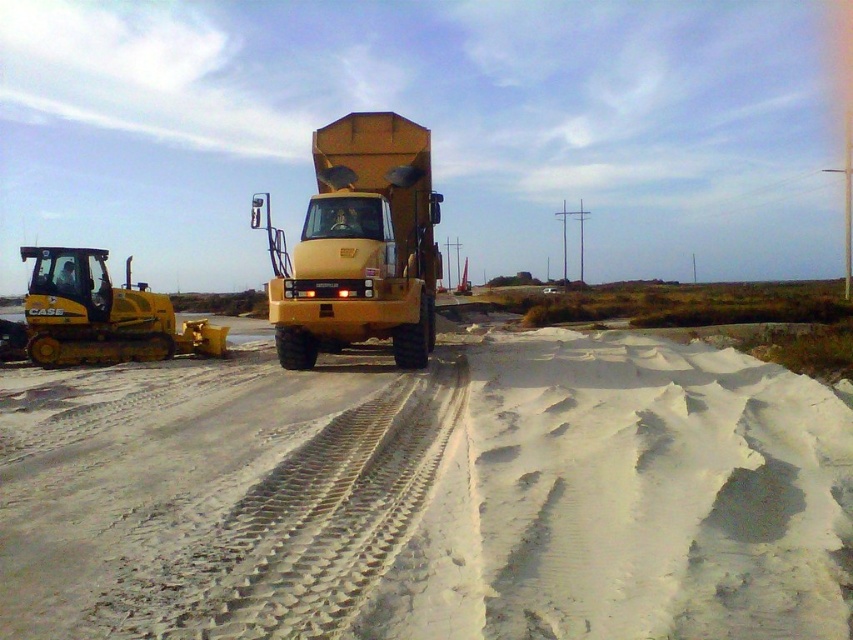
You are standing at the point marked by coordinates point (358, 244) in the construction scene. What object are you directly standing on?

The point (358, 244) marks the yellow matte dump truck at center, so you are directly standing on the yellow matte dump truck at center.

Looking at this image, you are a surveyor using a GPS device. You need to mark the location of the yellow matte dump truck at center. What are the coordinates of its position?

The coordinates of the yellow matte dump truck at center are at point (358, 244).

You are a construction worker standing at the edge of the sandy terrain. You need to move a heavy object from the yellow rubber plow at left to the yellow matte dump truck at center. Which direction should you move the object to ensure it is closer to the dump truck?

Since the yellow matte dump truck at center is closer to the viewer than the yellow rubber plow at left, you should move the object towards the dump truck, which is in the forward direction from the plow.